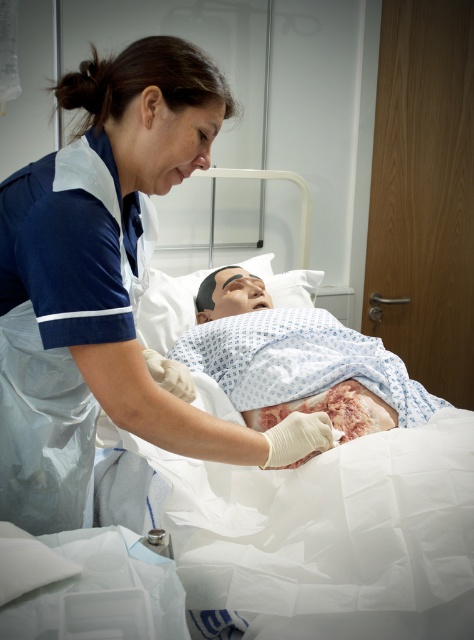
You are a medical student observing a training exercise. You notice the blue uniform at center and the scarred skin at center. Which object is taller in this scenario?

The blue uniform at center is taller than the scarred skin at center.